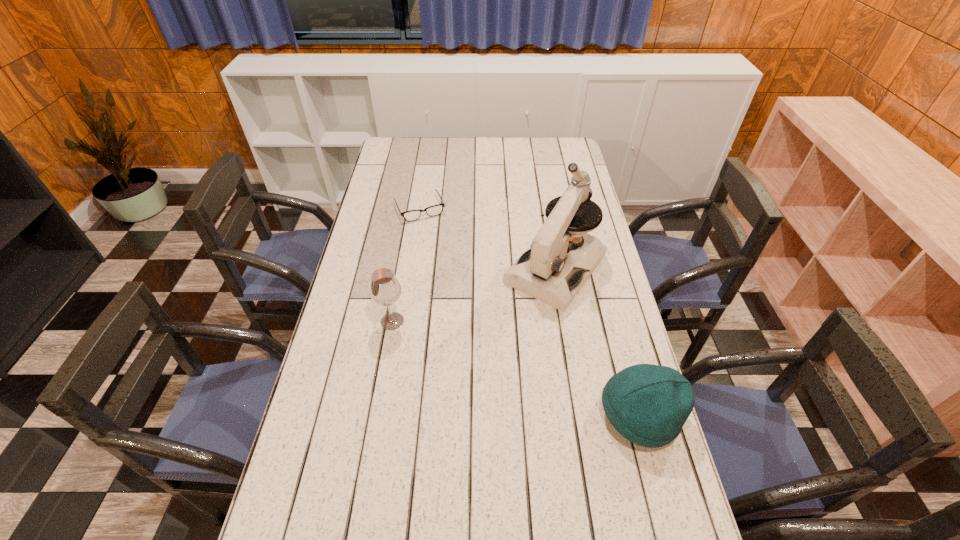
I want to click on wineglass, so click(385, 289).

I want to click on the nearest object, so click(647, 404).

Where is `beanie`? beanie is located at coordinates (647, 404).

Image resolution: width=960 pixels, height=540 pixels. Find the location of `microscope`. microscope is located at coordinates (549, 270).

Locate an element on the screen. The image size is (960, 540). spectacles is located at coordinates (412, 215).

Where is `the shortest object`? the shortest object is located at coordinates (412, 215).

Identify the location of vacant space located 0.380m on the back of the wineglass. Image resolution: width=960 pixels, height=540 pixels. (408, 232).

Locate an element on the screen. Image resolution: width=960 pixels, height=540 pixels. free location located on the left of the beanie is located at coordinates (484, 415).

You are a GUI agent. You are given a task and a screenshot of the screen. Output one action in this format:
    pyautogui.click(x=<x>, y=<y>)
    Task: Click on the free space located 0.330m at the eyepiece of the tallest object
    The image size is (960, 540).
    Given the screenshot: What is the action you would take?
    pyautogui.click(x=468, y=379)

Image resolution: width=960 pixels, height=540 pixels. Find the location of `free space located 0.380m at the eyepiece of the tallest object`. free space located 0.380m at the eyepiece of the tallest object is located at coordinates (458, 393).